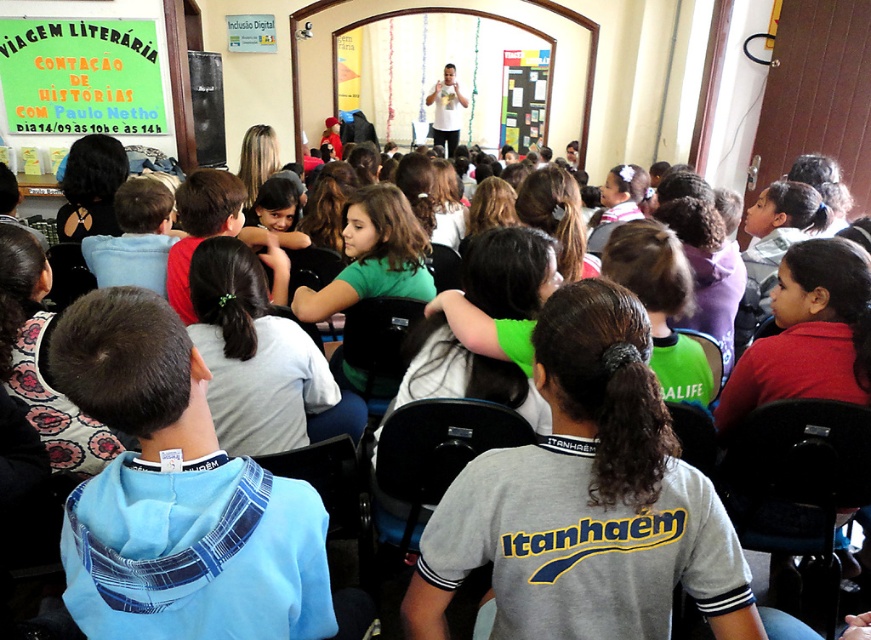
Who is more forward, (581,556) or (126,353)?

Positioned in front is point (126,353).

Does point (697, 564) come farther from viewer compared to point (188, 538)?

Yes, it is behind point (188, 538).

Image resolution: width=871 pixels, height=640 pixels. Identify the location of gray fabric shirt at center. (586, 499).

Who is taller, blue plaid hoodie at center or black plastic chair at lower right?

black plastic chair at lower right

Who is lower down, blue plaid hoodie at center or black plastic chair at lower right?

black plastic chair at lower right

Is point (170, 321) closer to viewer compared to point (746, 424)?

Yes, point (170, 321) is in front of point (746, 424).

The image size is (871, 640). In order to click on blue plaid hoodie at center in this screenshot , I will do `click(176, 496)`.

Is black plastic chair at lower right thinner than black plastic chair at center?

No, black plastic chair at lower right is not thinner than black plastic chair at center.

Is point (731, 476) in front of point (370, 381)?

Yes, it is.

Measure the distance between black plastic chair at lower right and camera.

black plastic chair at lower right and camera are 5.03 feet apart from each other.

Find the location of `black plastic chair at lower right`. black plastic chair at lower right is located at coordinates (799, 472).